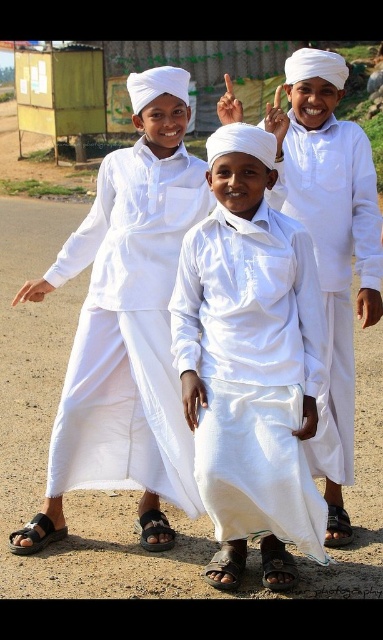
The width and height of the screenshot is (383, 640). I want to click on white cotton shirt at center, so click(250, 362).

Does point (247, 465) come closer to viewer compared to point (150, 241)?

Yes, point (247, 465) is closer to viewer.

Find the location of a particular element. The width and height of the screenshot is (383, 640). white cotton shirt at center is located at coordinates (250, 362).

Which is above, white cotton shirt at center or brown dirt field at lower left?

brown dirt field at lower left is higher up.

Can you confirm if white cotton shirt at center is positioned above brown dirt field at lower left?

No.

Is point (225, 225) behind point (6, 147)?

That is False.

I want to click on white cotton shirt at center, so click(x=250, y=362).

Which of these two, white cotton shirt at center or black leather sandal at lower left, stands shorter?

Standing shorter between the two is black leather sandal at lower left.

Is white cotton shirt at center smaller than black leather sandal at lower left?

Actually, white cotton shirt at center might be larger than black leather sandal at lower left.

Is point (268, 433) positioned in front of point (14, 547)?

Yes, point (268, 433) is closer to viewer.

I want to click on white cotton shirt at center, so click(250, 362).